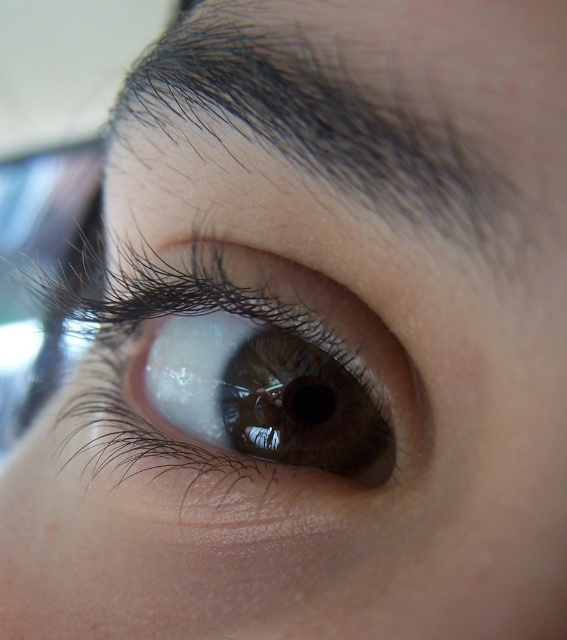
You are a photographer adjusting the lighting for a portrait. You notice the dark brown hair at upper center and the brown glossy eye at center in the frame. Which object is positioned higher in the image?

The dark brown hair at upper center is taller than the brown glossy eye at center, so the dark brown hair at upper center is positioned higher in the image.